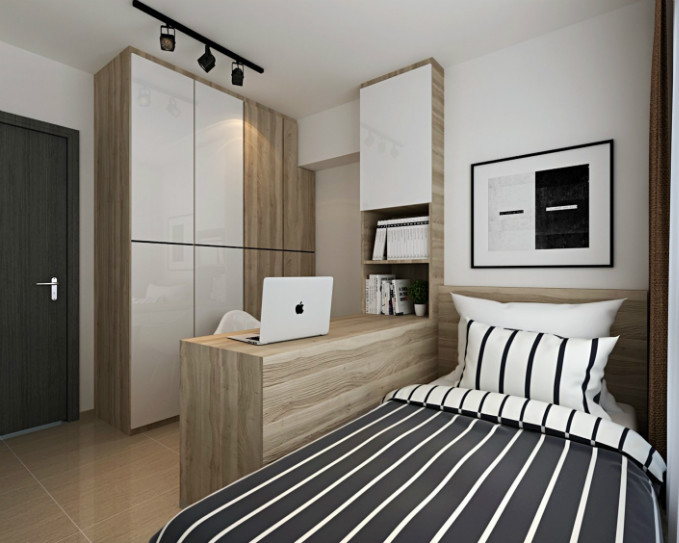
Locate an element on the screen. The height and width of the screenshot is (543, 679). shelf is located at coordinates (375, 261).